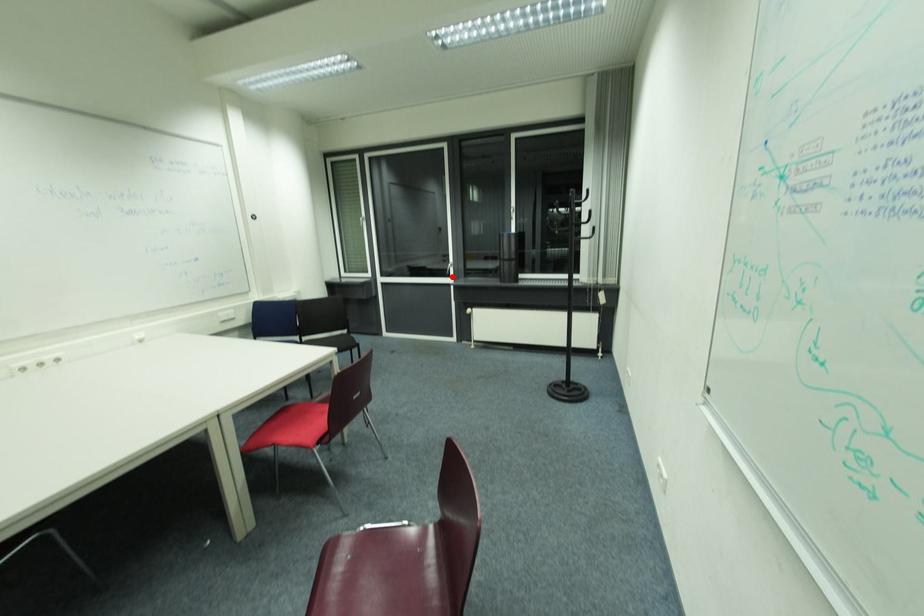
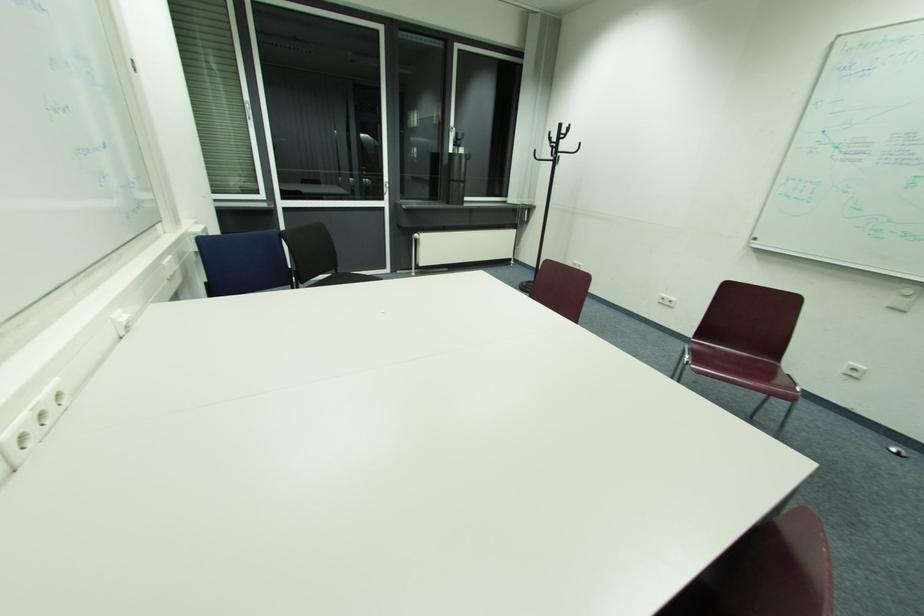
Where in the second image is the point corresponding to the highlighted location from the first image?

(384, 199)